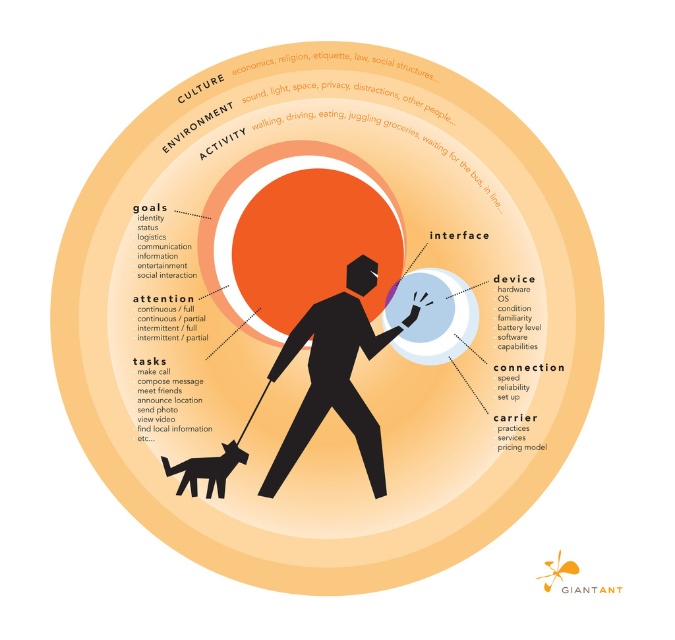
Who is lower down, transparent glass sphere at center or black matte dog at lower left?

Positioned lower is black matte dog at lower left.

Does transparent glass sphere at center have a larger size compared to black matte dog at lower left?

Yes, transparent glass sphere at center is bigger than black matte dog at lower left.

The height and width of the screenshot is (640, 675). In order to click on transparent glass sphere at center in this screenshot , I will do `click(324, 316)`.

The image size is (675, 640). What are the coordinates of `black matte figure at center` in the screenshot? It's located at (329, 385).

Between point (340, 388) and point (398, 320), which one is positioned in front?

Point (340, 388) is in front.

Which is behind, point (319, 349) or point (418, 320)?

The point (319, 349) is more distant.

Identify the location of black matte figure at center. The width and height of the screenshot is (675, 640). (329, 385).

Between point (383, 81) and point (432, 292), which one is positioned behind?

Point (432, 292)

Locate an element on the screen. The image size is (675, 640). transparent glass sphere at center is located at coordinates (324, 316).